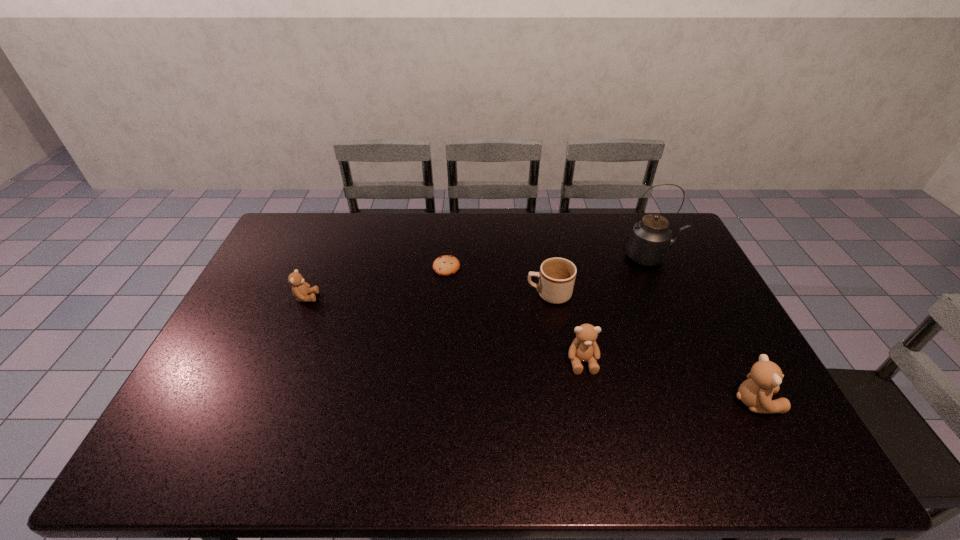
Identify the location of empty space between the mug and the tallest object. (601, 276).

You are a GUI agent. You are given a task and a screenshot of the screen. Output one action in this format:
    pyautogui.click(x=<x>, y=<y>)
    Task: Click on the vacant area that lies between the tallest object and the leftmost object
    
    Given the screenshot: What is the action you would take?
    pyautogui.click(x=479, y=277)

Locate an element on the screen. The width and height of the screenshot is (960, 540). free space that is in between the shortest teddy bear and the nearest teddy bear is located at coordinates (531, 349).

In order to click on free space between the nearest object and the cookie in this screenshot , I will do `click(601, 334)`.

You are a GUI agent. You are given a task and a screenshot of the screen. Output one action in this format:
    pyautogui.click(x=<x>, y=<y>)
    Task: Click on the empty space that is in between the leftmost object and the mug
    This screenshot has width=960, height=540.
    Given the screenshot: What is the action you would take?
    pyautogui.click(x=427, y=296)

Locate an element on the screen. The width and height of the screenshot is (960, 540). vacant area that lies between the second teddy bear from right to left and the tallest teddy bear is located at coordinates (x=669, y=382).

Locate an element on the screen. The width and height of the screenshot is (960, 540). free space that is in between the mug and the second farthest teddy bear is located at coordinates 565,328.

The image size is (960, 540). I want to click on object that is the fifth closest to the mug, so click(x=300, y=289).

Identify which object is the third closest to the tallest object. Please provide its 2D coordinates. Your answer should be formatted as a tuple, i.e. [(x, y)], where the tuple contains the x and y coordinates of a point satisfying the conditions above.

[(763, 381)]

Where is `the third closest teddy bear to the kettle`? the third closest teddy bear to the kettle is located at coordinates (300, 289).